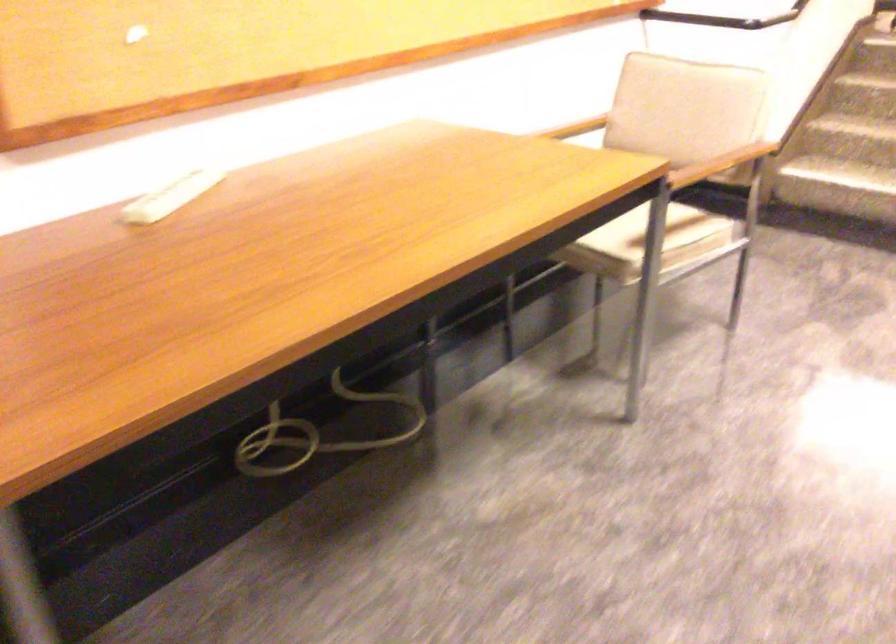
What do you see at coordinates (648, 242) in the screenshot?
I see `a chair sitting surface` at bounding box center [648, 242].